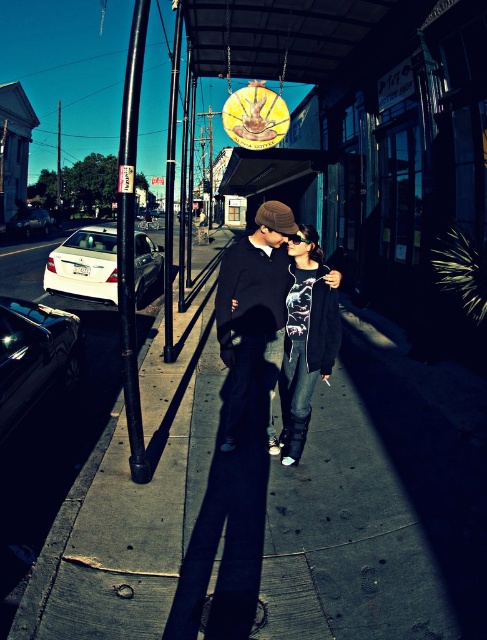
Question: In this image, where is denim jacket at center located relative to smooth black pole at center?

Choices:
 (A) right
 (B) left

Answer: (A)

Question: Which point is farther to the camera?

Choices:
 (A) (166, 346)
 (B) (203, 364)

Answer: (B)

Question: Does dark concrete sidewalk at center come in front of smooth black pole at center?

Choices:
 (A) no
 (B) yes

Answer: (B)

Question: Among these points, which one is farthest from the camera?

Choices:
 (A) (178, 4)
 (B) (128, 435)

Answer: (A)

Question: Which of the following is the closest to the observer?

Choices:
 (A) dark concrete sidewalk at center
 (B) denim jacket at center
 (C) black metal pole at left

Answer: (A)

Question: Can you confirm if matte black hoodie at center is wider than black metal pole at left?

Choices:
 (A) yes
 (B) no

Answer: (A)